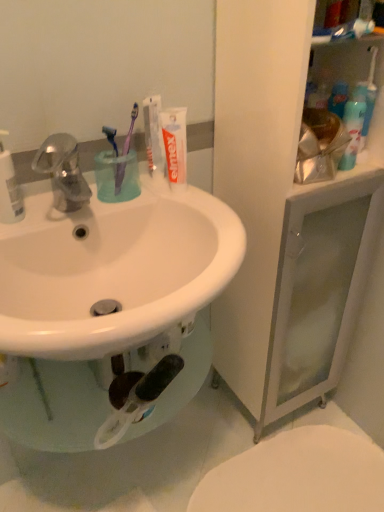
Find the location of a particular element. This screenshot has width=384, height=512. blank area beneath white glossy toilet at lower right (from a real-world perspective) is located at coordinates (291, 478).